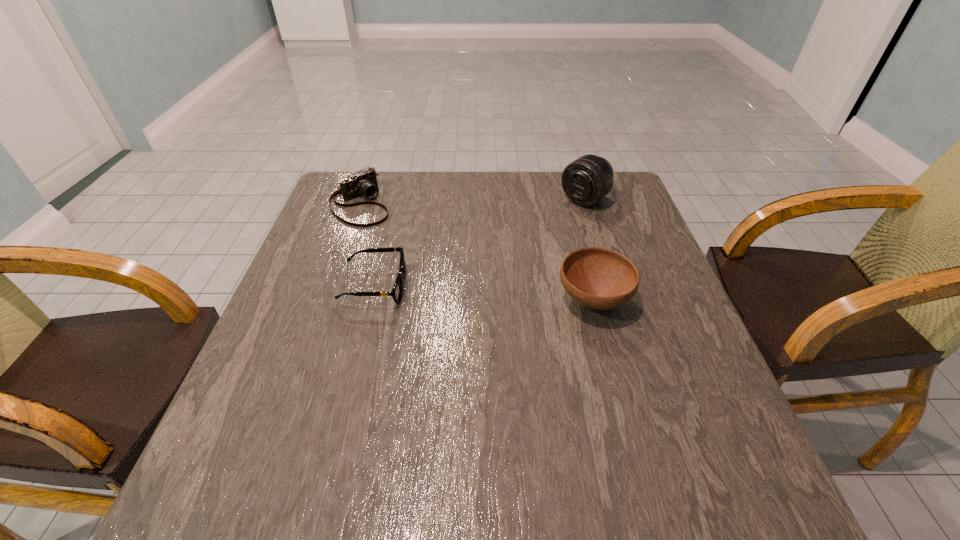
I want to click on the shortest object, so click(x=397, y=290).

The width and height of the screenshot is (960, 540). In order to click on bowl in this screenshot , I will do `click(598, 278)`.

At what (x,y) coordinates should I click in order to perform the action: click on camera. Please return your answer as a coordinate pair (x, y). This screenshot has height=540, width=960. Looking at the image, I should click on (363, 183).

The height and width of the screenshot is (540, 960). What are the coordinates of `telephoto lens` in the screenshot? It's located at point(588,179).

Find the location of a particular element. free space located on the front-facing side of the shortest object is located at coordinates (503, 286).

Where is `free region located 0.360m on the left of the third shortest object`? free region located 0.360m on the left of the third shortest object is located at coordinates (x=399, y=300).

I want to click on blank space located on the front-facing side of the camera, so click(460, 294).

Locate an element on the screen. The height and width of the screenshot is (540, 960). blank space located 0.130m on the front-facing side of the camera is located at coordinates (401, 243).

Identify the location of vacant space situated 0.380m on the front-facing side of the camera. (460, 294).

You are a GUI agent. You are given a task and a screenshot of the screen. Output one action in this format:
    pyautogui.click(x=<x>, y=<y>)
    Task: Click on the blank space located 0.240m on the front-facing side of the telephoto lens
    
    Given the screenshot: What is the action you would take?
    pyautogui.click(x=518, y=249)